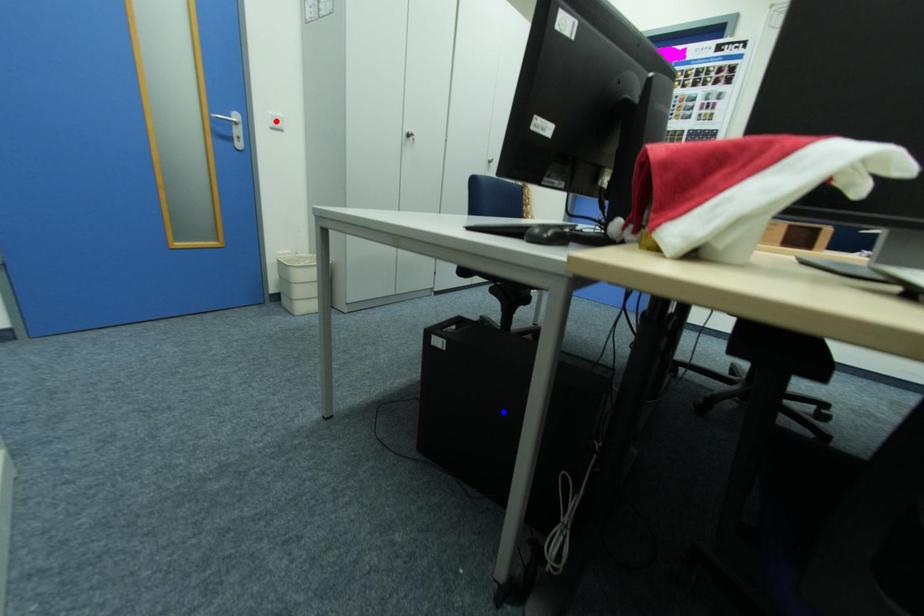
Question: Which of the two points in the image is closer to the camera?

Choices:
 (A) Blue point is closer.
 (B) Red point is closer.

Answer: (A)